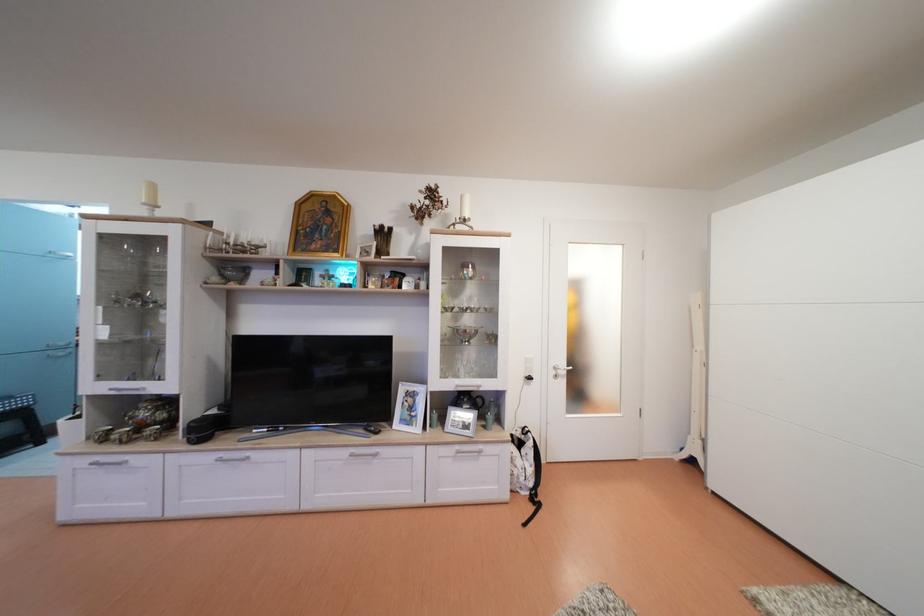
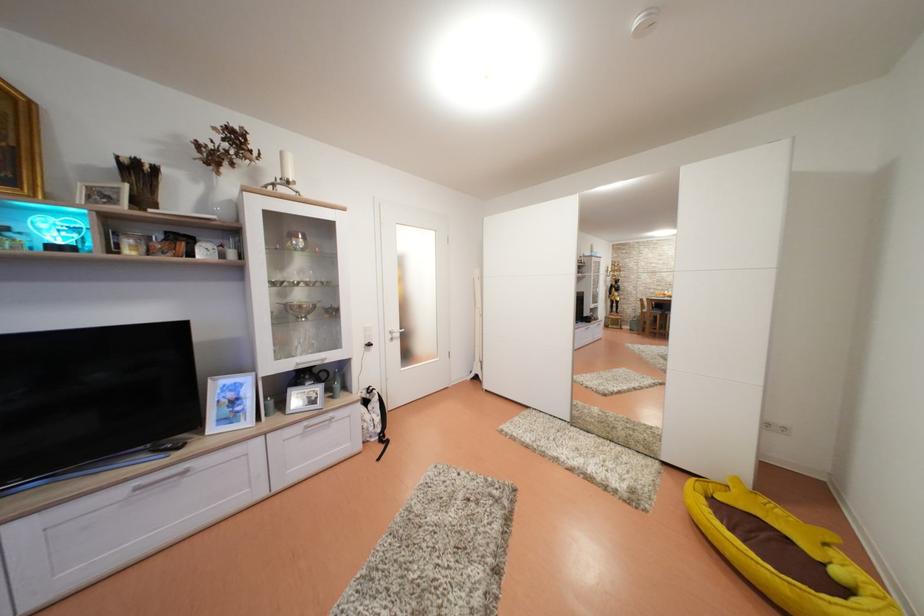
Question: The camera is either moving clockwise (left) or counter-clockwise (right) around the object. The first image is from the beginning of the video and the second image is from the end. Is the camera moving left or right when shooting the video?

Choices:
 (A) Left
 (B) Right

Answer: (A)